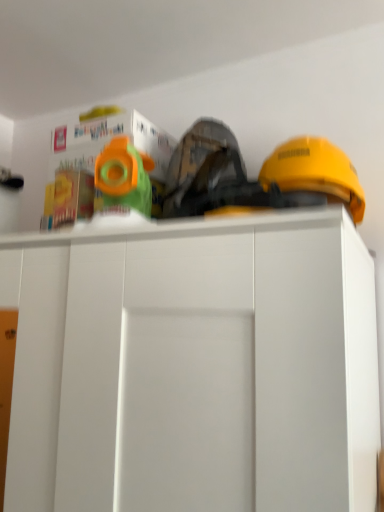
The image size is (384, 512). Describe the element at coordinates (68, 198) in the screenshot. I see `matte plastic toy at upper left, positioned as the 1th toy in left-to-right order` at that location.

What do you see at coordinates (314, 170) in the screenshot? This screenshot has width=384, height=512. I see `yellow hard hat at upper right` at bounding box center [314, 170].

Measure the distance between green plastic toy at upper center, arranged as the second toy when viewed from the left, and camera.

A distance of 25.43 inches exists between green plastic toy at upper center, arranged as the second toy when viewed from the left, and camera.

Locate an element on the screen. This screenshot has width=384, height=512. matte plastic toy at upper left, positioned as the 1th toy in left-to-right order is located at coordinates (68, 198).

From a real-world perspective, who is located higher, yellow hard hat at upper right or white matte cabinet at center?

In real-world perspective, yellow hard hat at upper right is above.

Is white matte cabinet at center located within yellow hard hat at upper right?

That's incorrect, white matte cabinet at center is not inside yellow hard hat at upper right.

Is yellow hard hat at upper right shorter than white matte cabinet at center?

Correct, yellow hard hat at upper right is not as tall as white matte cabinet at center.

Is yellow hard hat at upper right looking in the opposite direction of white matte cabinet at center?

yellow hard hat at upper right does not have its back to white matte cabinet at center.

From the picture: Can you confirm if white matte cabinet at center is smaller than yellow hard hat at upper right?

No.

Does white matte cabinet at center have a lesser height compared to yellow hard hat at upper right?

Incorrect, the height of white matte cabinet at center does not fall short of that of yellow hard hat at upper right.

Which is nearer, (350, 396) or (283, 184)?

Point (350, 396)

Which object is positioned more to the left, white matte cabinet at center or yellow hard hat at upper right?

white matte cabinet at center is more to the left.

Is matte plastic toy at upper left, the 2th toy in the right-to-left sequence, at the back of yellow hard hat at upper right?

No, yellow hard hat at upper right is not facing away from matte plastic toy at upper left, the 2th toy in the right-to-left sequence.

This screenshot has height=512, width=384. I want to click on helmet located above the matte plastic toy at upper left, positioned as the 1th toy in left-to-right order (from the image's perspective), so [314, 170].

Is yellow hard hat at upper right wider or thinner than matte plastic toy at upper left, the 2th toy in the right-to-left sequence?

Clearly, yellow hard hat at upper right has more width compared to matte plastic toy at upper left, the 2th toy in the right-to-left sequence.

From the image's perspective, is matte plastic toy at upper left, the 2th toy in the right-to-left sequence, under yellow hard hat at upper right?

Yes, from the image's perspective, matte plastic toy at upper left, the 2th toy in the right-to-left sequence, is below yellow hard hat at upper right.

Does matte plastic toy at upper left, positioned as the 1th toy in left-to-right order, have a greater width compared to yellow hard hat at upper right?

In fact, matte plastic toy at upper left, positioned as the 1th toy in left-to-right order, might be narrower than yellow hard hat at upper right.

Considering the relative positions of matte plastic toy at upper left, the 2th toy in the right-to-left sequence, and yellow hard hat at upper right in the image provided, is matte plastic toy at upper left, the 2th toy in the right-to-left sequence, behind yellow hard hat at upper right?

Yes, matte plastic toy at upper left, the 2th toy in the right-to-left sequence, is behind yellow hard hat at upper right.

Which is behind, point (67, 176) or point (271, 181)?

Positioned behind is point (67, 176).

Between white matte cabinet at center and green plastic toy at upper center, which ranks as the first toy in right-to-left order, which one has larger width?

With larger width is white matte cabinet at center.

Does white matte cabinet at center have a smaller size compared to green plastic toy at upper center, which ranks as the first toy in right-to-left order?

Actually, white matte cabinet at center might be larger than green plastic toy at upper center, which ranks as the first toy in right-to-left order.

Is white matte cabinet at center not close to green plastic toy at upper center, which ranks as the first toy in right-to-left order?

No, there isn't a large distance between white matte cabinet at center and green plastic toy at upper center, which ranks as the first toy in right-to-left order.

Considering the sizes of green plastic toy at upper center, arranged as the second toy when viewed from the left, and white matte cabinet at center in the image, is green plastic toy at upper center, arranged as the second toy when viewed from the left, taller or shorter than white matte cabinet at center?

In the image, green plastic toy at upper center, arranged as the second toy when viewed from the left, appears to be shorter than white matte cabinet at center.

In the scene shown: How distant is green plastic toy at upper center, arranged as the second toy when viewed from the left, from white matte cabinet at center?

green plastic toy at upper center, arranged as the second toy when viewed from the left, is 24.97 centimeters from white matte cabinet at center.

Which is behind, point (126, 190) or point (127, 342)?

Positioned behind is point (126, 190).

Which of these two, green plastic toy at upper center, which ranks as the first toy in right-to-left order, or white matte cabinet at center, is bigger?

With larger size is white matte cabinet at center.

Is matte plastic toy at upper left, the 2th toy in the right-to-left sequence, bigger than white matte cabinet at center?

Actually, matte plastic toy at upper left, the 2th toy in the right-to-left sequence, might be smaller than white matte cabinet at center.

Are matte plastic toy at upper left, the 2th toy in the right-to-left sequence, and white matte cabinet at center located far from each other?

matte plastic toy at upper left, the 2th toy in the right-to-left sequence, is near white matte cabinet at center, not far away.

From the white matte cabinet at center, count 1st toy to the right and point to it. Please provide its 2D coordinates.

[(68, 198)]

Where is `cabinetry below the yellow hard hat at upper right (from a real-world perspective)`? This screenshot has width=384, height=512. cabinetry below the yellow hard hat at upper right (from a real-world perspective) is located at coordinates (194, 365).

Where is `helmet behind the white matte cabinet at center`? helmet behind the white matte cabinet at center is located at coordinates (314, 170).

In the scene shown: When comparing their distances from matte plastic toy at upper left, the 2th toy in the right-to-left sequence, does green plastic toy at upper center, arranged as the second toy when viewed from the left, or white matte cabinet at center seem closer?

The object closer to matte plastic toy at upper left, the 2th toy in the right-to-left sequence, is green plastic toy at upper center, arranged as the second toy when viewed from the left.

From the image, which object appears to be nearer to white matte cabinet at center, matte plastic toy at upper left, the 2th toy in the right-to-left sequence, or yellow hard hat at upper right?

The object closer to white matte cabinet at center is matte plastic toy at upper left, the 2th toy in the right-to-left sequence.

Looking at the image, which one is located closer to green plastic toy at upper center, arranged as the second toy when viewed from the left, matte plastic toy at upper left, positioned as the 1th toy in left-to-right order, or white matte cabinet at center?

matte plastic toy at upper left, positioned as the 1th toy in left-to-right order, is closer to green plastic toy at upper center, arranged as the second toy when viewed from the left.

Estimate the real-world distances between objects in this image. Which object is further from matte plastic toy at upper left, the 2th toy in the right-to-left sequence, white matte cabinet at center or yellow hard hat at upper right?

yellow hard hat at upper right is further to matte plastic toy at upper left, the 2th toy in the right-to-left sequence.

Considering their positions, is yellow hard hat at upper right positioned closer to white matte cabinet at center than matte plastic toy at upper left, positioned as the 1th toy in left-to-right order?

matte plastic toy at upper left, positioned as the 1th toy in left-to-right order.

Looking at the image, which one is located closer to green plastic toy at upper center, arranged as the second toy when viewed from the left, matte plastic toy at upper left, positioned as the 1th toy in left-to-right order, or yellow hard hat at upper right?

Based on the image, matte plastic toy at upper left, positioned as the 1th toy in left-to-right order, appears to be nearer to green plastic toy at upper center, arranged as the second toy when viewed from the left.

Estimate the real-world distances between objects in this image. Which object is further from matte plastic toy at upper left, positioned as the 1th toy in left-to-right order, yellow hard hat at upper right or white matte cabinet at center?

The object further to matte plastic toy at upper left, positioned as the 1th toy in left-to-right order, is yellow hard hat at upper right.

Estimate the real-world distances between objects in this image. Which object is further from matte plastic toy at upper left, positioned as the 1th toy in left-to-right order, yellow hard hat at upper right or green plastic toy at upper center, arranged as the second toy when viewed from the left?

Based on the image, yellow hard hat at upper right appears to be further to matte plastic toy at upper left, positioned as the 1th toy in left-to-right order.

The image size is (384, 512). Identify the location of helmet that lies between green plastic toy at upper center, which ranks as the first toy in right-to-left order, and white matte cabinet at center from top to bottom. (314, 170).

The height and width of the screenshot is (512, 384). Find the location of `toy between matte plastic toy at upper left, the 2th toy in the right-to-left sequence, and yellow hard hat at upper right from left to right`. toy between matte plastic toy at upper left, the 2th toy in the right-to-left sequence, and yellow hard hat at upper right from left to right is located at coordinates (124, 176).

The height and width of the screenshot is (512, 384). Identify the location of toy between green plastic toy at upper center, which ranks as the first toy in right-to-left order, and white matte cabinet at center, in the vertical direction. (68, 198).